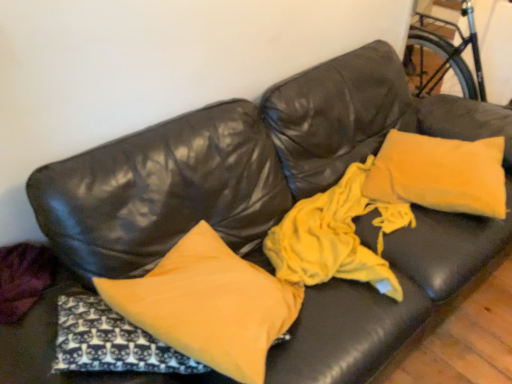
Question: Does yellow soft pillow at upper right, which is counted as the first pillow, starting from the right, have a greater width compared to matte yellow pillow at center, which ranks as the second pillow in back-to-front order?

Choices:
 (A) no
 (B) yes

Answer: (A)

Question: From the image's perspective, is yellow soft pillow at upper right, which appears as the first pillow when viewed from the back, under matte yellow pillow at center, arranged as the first pillow when viewed from the front?

Choices:
 (A) no
 (B) yes

Answer: (A)

Question: Can you confirm if yellow soft pillow at upper right, which appears as the first pillow when viewed from the back, is positioned to the right of matte yellow pillow at center, the 2th pillow positioned from the right?

Choices:
 (A) yes
 (B) no

Answer: (A)

Question: Would you consider yellow soft pillow at upper right, marked as the second pillow in a left-to-right arrangement, to be distant from matte yellow pillow at center, which is the 1th pillow from left to right?

Choices:
 (A) no
 (B) yes

Answer: (A)

Question: Could you tell me if yellow soft pillow at upper right, which is counted as the first pillow, starting from the right, is facing matte yellow pillow at center, which is the 1th pillow from left to right?

Choices:
 (A) yes
 (B) no

Answer: (B)

Question: Can you confirm if yellow soft pillow at upper right, which is counted as the first pillow, starting from the right, is thinner than matte yellow pillow at center, arranged as the first pillow when viewed from the front?

Choices:
 (A) yes
 (B) no

Answer: (A)

Question: Is yellow soft pillow at upper right, which is counted as the first pillow, starting from the right, a part of matte yellow pillow at center, the 2th pillow positioned from the right?

Choices:
 (A) yes
 (B) no

Answer: (B)

Question: Would you say matte yellow pillow at center, the 2th pillow positioned from the right, is a long distance from yellow soft pillow at upper right, marked as the second pillow in a left-to-right arrangement?

Choices:
 (A) no
 (B) yes

Answer: (A)

Question: Does matte yellow pillow at center, arranged as the first pillow when viewed from the front, have a larger size compared to yellow soft pillow at upper right, which appears as the second pillow when viewed from the front?

Choices:
 (A) yes
 (B) no

Answer: (A)

Question: Is matte yellow pillow at center, which ranks as the second pillow in back-to-front order, positioned with its back to yellow soft pillow at upper right, which is counted as the first pillow, starting from the right?

Choices:
 (A) no
 (B) yes

Answer: (A)

Question: Is matte yellow pillow at center, which is the 1th pillow from left to right, facing towards yellow soft pillow at upper right, which appears as the second pillow when viewed from the front?

Choices:
 (A) no
 (B) yes

Answer: (A)

Question: Does matte yellow pillow at center, the 2th pillow positioned from the right, lie in front of yellow soft pillow at upper right, which appears as the first pillow when viewed from the back?

Choices:
 (A) yes
 (B) no

Answer: (A)

Question: Is point (206, 253) closer or farther from the camera than point (458, 140)?

Choices:
 (A) closer
 (B) farther

Answer: (A)